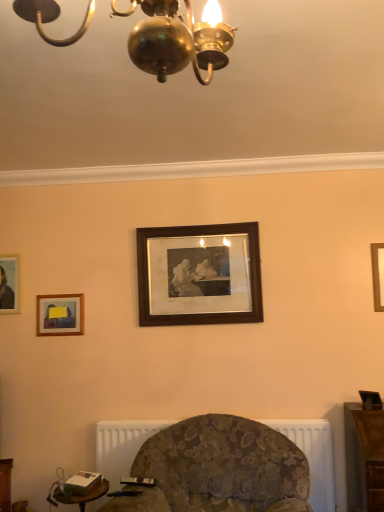
Question: Does wooden picture frame at right, which appears as the 4th picture frame when viewed from the left, have a greater height compared to white textured radiator at lower center?

Choices:
 (A) no
 (B) yes

Answer: (A)

Question: Is wooden picture frame at right, marked as the first picture frame in a right-to-left arrangement, positioned in front of white textured radiator at lower center?

Choices:
 (A) yes
 (B) no

Answer: (B)

Question: Is wooden picture frame at right, marked as the first picture frame in a right-to-left arrangement, further to the viewer compared to white textured radiator at lower center?

Choices:
 (A) yes
 (B) no

Answer: (A)

Question: Is wooden picture frame at right, which appears as the 4th picture frame when viewed from the left, to the right of white textured radiator at lower center from the viewer's perspective?

Choices:
 (A) no
 (B) yes

Answer: (B)

Question: Does wooden picture frame at right, marked as the first picture frame in a right-to-left arrangement, have a larger size compared to white textured radiator at lower center?

Choices:
 (A) no
 (B) yes

Answer: (A)

Question: Can you confirm if wooden picture frame at right, which appears as the 4th picture frame when viewed from the left, is thinner than white textured radiator at lower center?

Choices:
 (A) no
 (B) yes

Answer: (B)

Question: Is wooden picture frame at left, which is counted as the 4th picture frame, starting from the right, next to wooden picture frame at right, which appears as the 4th picture frame when viewed from the left, and touching it?

Choices:
 (A) no
 (B) yes

Answer: (A)

Question: Is wooden picture frame at left, which is counted as the 4th picture frame, starting from the right, aimed at wooden picture frame at right, marked as the first picture frame in a right-to-left arrangement?

Choices:
 (A) no
 (B) yes

Answer: (A)

Question: From the image's perspective, does wooden picture frame at left, which is the first picture frame in left-to-right order, appear lower than wooden picture frame at right, marked as the first picture frame in a right-to-left arrangement?

Choices:
 (A) yes
 (B) no

Answer: (A)

Question: Is wooden picture frame at left, which is the first picture frame in left-to-right order, bigger than wooden picture frame at right, marked as the first picture frame in a right-to-left arrangement?

Choices:
 (A) yes
 (B) no

Answer: (A)

Question: Is wooden picture frame at right, which appears as the 4th picture frame when viewed from the left, surrounded by wooden picture frame at left, which is the first picture frame in left-to-right order?

Choices:
 (A) no
 (B) yes

Answer: (A)

Question: Does wooden picture frame at left, which is counted as the 4th picture frame, starting from the right, appear on the right side of wooden picture frame at right, marked as the first picture frame in a right-to-left arrangement?

Choices:
 (A) yes
 (B) no

Answer: (B)

Question: Does brown wooden picture frame at center, which is counted as the 3th picture frame, starting from the left, contain wooden picture frame at right, marked as the first picture frame in a right-to-left arrangement?

Choices:
 (A) no
 (B) yes

Answer: (A)